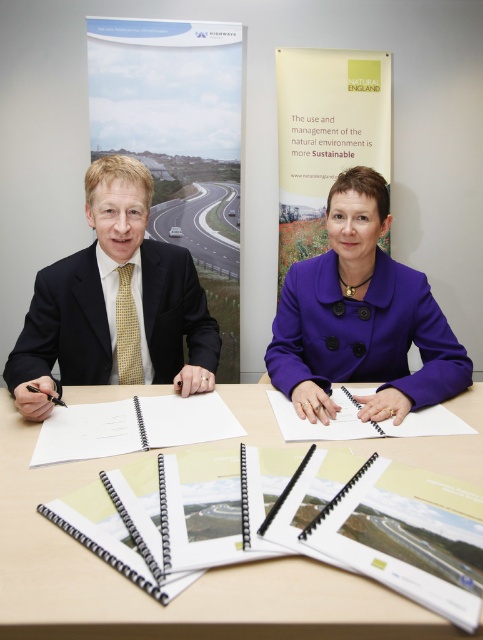
You are a photographer standing at the back of the room. You want to take a photo of the wooden table at center and the purple woolen coat at center. Based on their heights, which object will appear closer to the camera in the photo?

The purple woolen coat at center has a greater height than the wooden table at center, so it will appear closer to the camera in the photo.

You are standing in front of the table where the two individuals are seated. There are two points marked on the table. One is at coordinate point (8, 636) and the other at point (292, 369). Which of these points is closer to you?

The point at coordinate point (8, 636) is closer to you than the point at (292, 369).